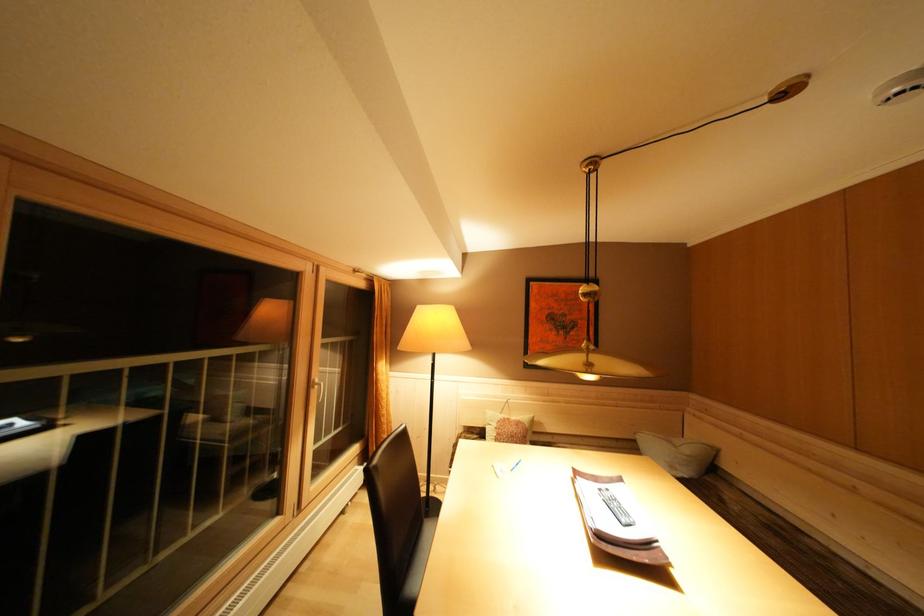
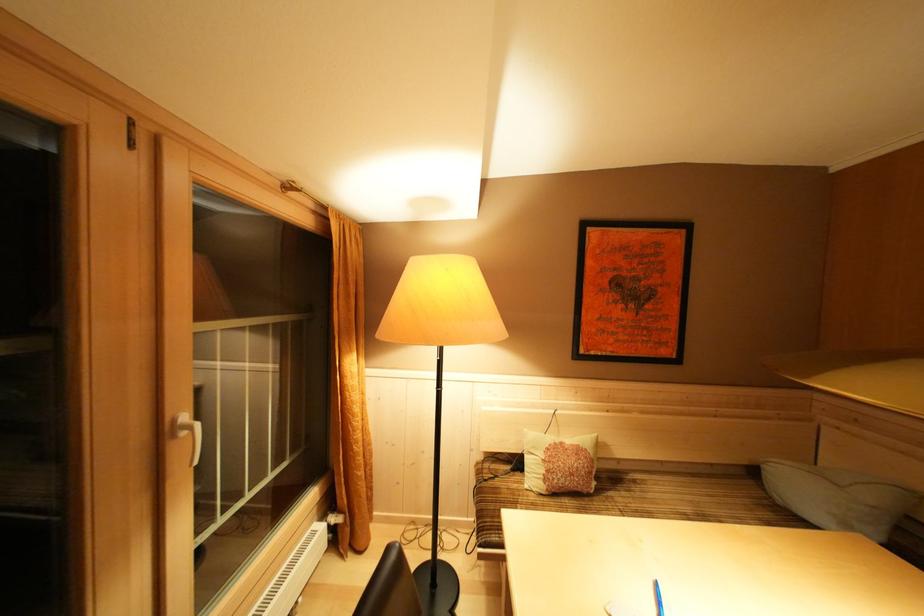
In the second image, find the point that corresponds to the point at 388,363 in the first image.

(358, 357)